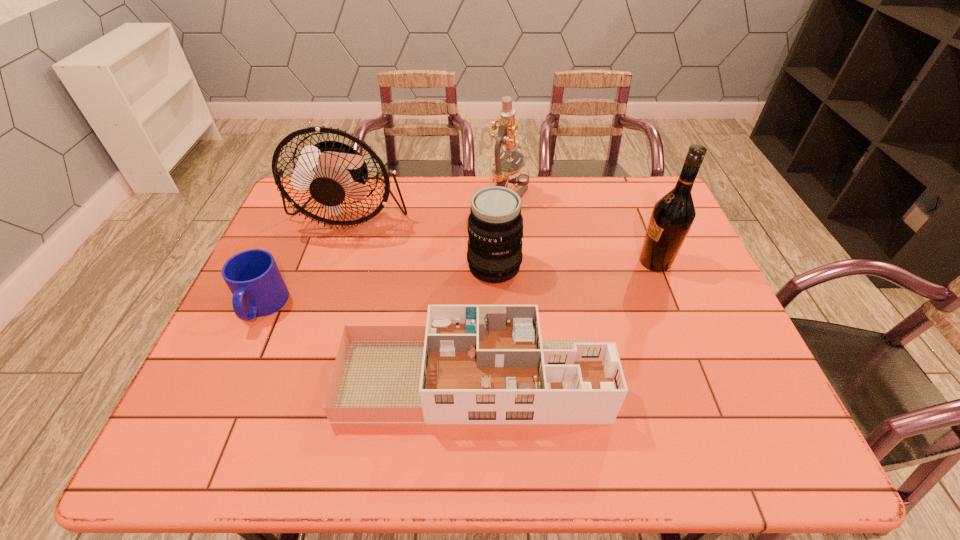
Find the location of a particular element. blank space located in front of the fan, directing airflow is located at coordinates (329, 275).

Locate an element on the screen. The height and width of the screenshot is (540, 960). free space located on the back of the third shortest object is located at coordinates (492, 210).

Identify the location of blank space located at the front door of the nearest object. This screenshot has width=960, height=540. (724, 379).

Find the location of a particular element. free space located 0.090m on the side with the handle of the mug is located at coordinates (236, 364).

At what (x,y) coordinates should I click in order to perform the action: click on microscope that is at the far edge. Please return your answer as a coordinate pair (x, y). The height and width of the screenshot is (540, 960). Looking at the image, I should click on (504, 172).

I want to click on fan at the far edge, so click(330, 170).

Identify the location of object that is positioned at the near edge. This screenshot has height=540, width=960. (471, 364).

Find the location of `fan that is positioned at the left edge`. fan that is positioned at the left edge is located at coordinates (330, 170).

Image resolution: width=960 pixels, height=540 pixels. I want to click on mug present at the left edge, so click(253, 277).

The height and width of the screenshot is (540, 960). What are the coordinates of `object at the right edge` in the screenshot? It's located at (672, 216).